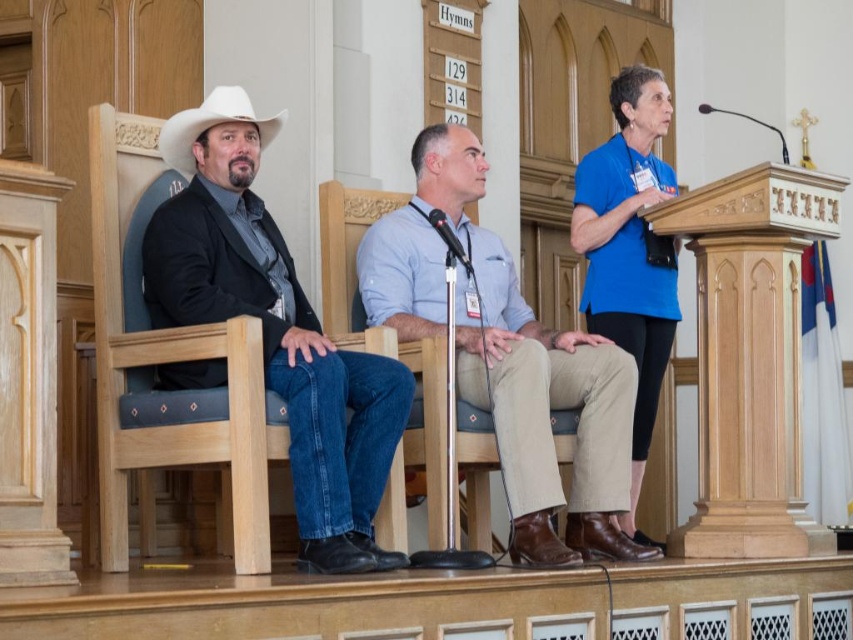
You are an interior designer planning to place a new decorative item in the scene. Considering the sizes of the blue fabric shirt at upper right and the white matte cowboy hat at left, which object would allow for more space around it for additional decorations?

The white matte cowboy hat at left occupies more space than the blue fabric shirt at upper right, so placing decorations around it would allow for more space.

You are a photographer positioned at the back of the venue. You need to capture a photo that includes both the blue fabric shirt at upper right and the black plastic microphone at center. Based on their positions, which object should you adjust your camera angle to focus on first to ensure both are in frame?

The blue fabric shirt at upper right is to the right of the black plastic microphone at center. To include both in the frame, focus on the black plastic microphone at center first, then adjust the angle to include the blue fabric shirt at upper right which is positioned to its right.

Where is the light blue cotton shirt at center located in the image?

The light blue cotton shirt at center is located at point [508,358].